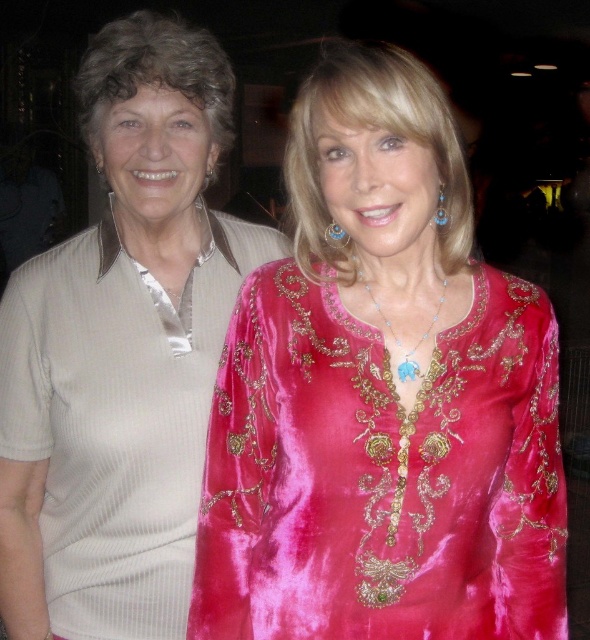
Question: Considering the relative positions of velvet pink dress at center and beige ribbed sweater at left in the image provided, where is velvet pink dress at center located with respect to beige ribbed sweater at left?

Choices:
 (A) below
 (B) above

Answer: (A)

Question: Which point is farther to the camera?

Choices:
 (A) velvet pink dress at center
 (B) beige ribbed sweater at left

Answer: (B)

Question: Where is velvet pink dress at center located in relation to beige ribbed sweater at left in the image?

Choices:
 (A) below
 (B) above

Answer: (A)

Question: Which point is closer to the camera?

Choices:
 (A) velvet pink dress at center
 (B) beige ribbed sweater at left

Answer: (A)

Question: Is velvet pink dress at center below beige ribbed sweater at left?

Choices:
 (A) no
 (B) yes

Answer: (B)